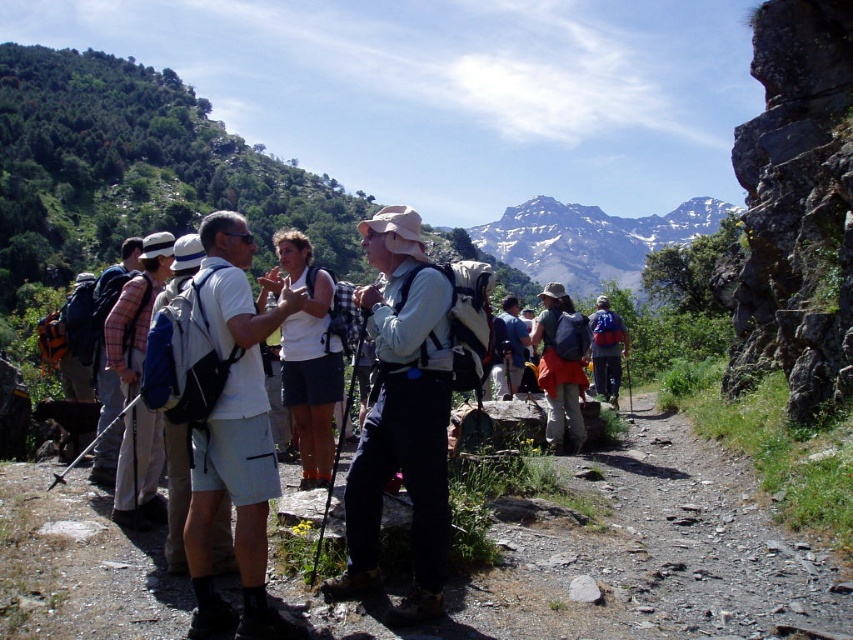
Question: Which of the following is the farthest from the observer?

Choices:
 (A) matte orange backpack at center-right
 (B) matte khaki pants at center

Answer: (A)

Question: Does dirt path at center have a larger size compared to matte khaki pants at center?

Choices:
 (A) yes
 (B) no

Answer: (A)

Question: Which object is closer to the camera taking this photo?

Choices:
 (A) matte orange backpack at center-right
 (B) matte khaki pants at center
 (C) plaid fabric shirt at left

Answer: (B)

Question: Which point is farther from the camera taking this photo?

Choices:
 (A) (572, 390)
 (B) (119, 323)
 (C) (583, 296)
 (D) (399, 305)

Answer: (C)

Question: Does plaid fabric shirt at left have a smaller size compared to matte orange backpack at center-right?

Choices:
 (A) no
 (B) yes

Answer: (A)

Question: Can you confirm if matte khaki pants at center is wider than matte orange backpack at center-right?

Choices:
 (A) no
 (B) yes

Answer: (B)